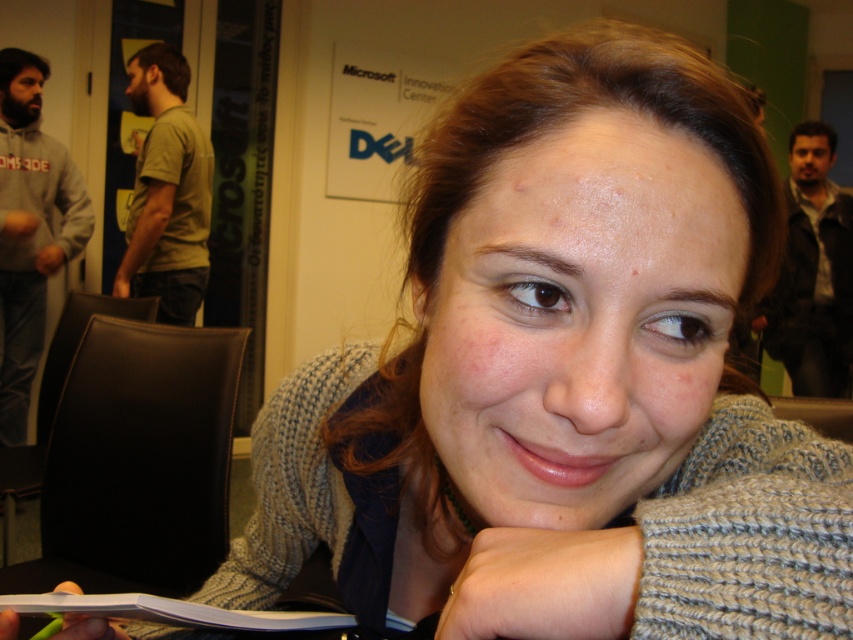
Describe the element at coordinates (30, 228) in the screenshot. I see `gray hoodie at left` at that location.

Does point (12, 240) come behind point (178, 280)?

Yes, point (12, 240) is behind point (178, 280).

What are the coordinates of `gray hoodie at left` in the screenshot? It's located at (30, 228).